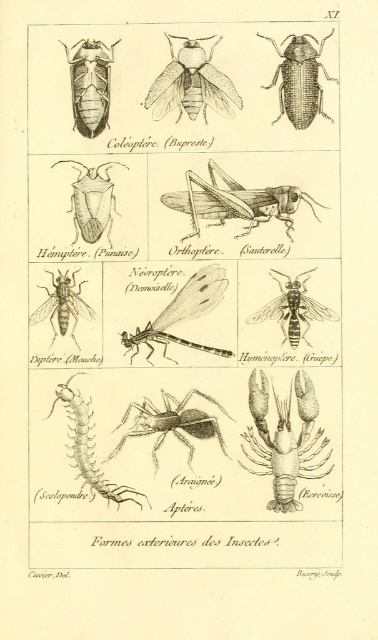
Question: Which point is closer to the camera?

Choices:
 (A) matte brown beetle at center-left
 (B) yellow striped wasp at center

Answer: (A)

Question: Can you confirm if brown matte spider at center is positioned to the right of translucent yellowishmaterial/texturefly at center-left?

Choices:
 (A) no
 (B) yes

Answer: (B)

Question: Which object appears farthest from the camera in this image?

Choices:
 (A) matte black beetle at upper left
 (B) black matte beetle at upper right

Answer: (A)

Question: From the image, what is the correct spatial relationship of matte black beetle at upper left in relation to matte brown beetle at center-left?

Choices:
 (A) right
 (B) left

Answer: (B)

Question: Is matte black beetle at upper center smaller than translucent yellowishmaterial/texturefly at center-left?

Choices:
 (A) no
 (B) yes

Answer: (A)

Question: Which point is closer to the camera?

Choices:
 (A) translucent yellowish-green dragonfly at center
 (B) matte black beetle at upper left
 (C) brown/dry grasshopper at center

Answer: (B)